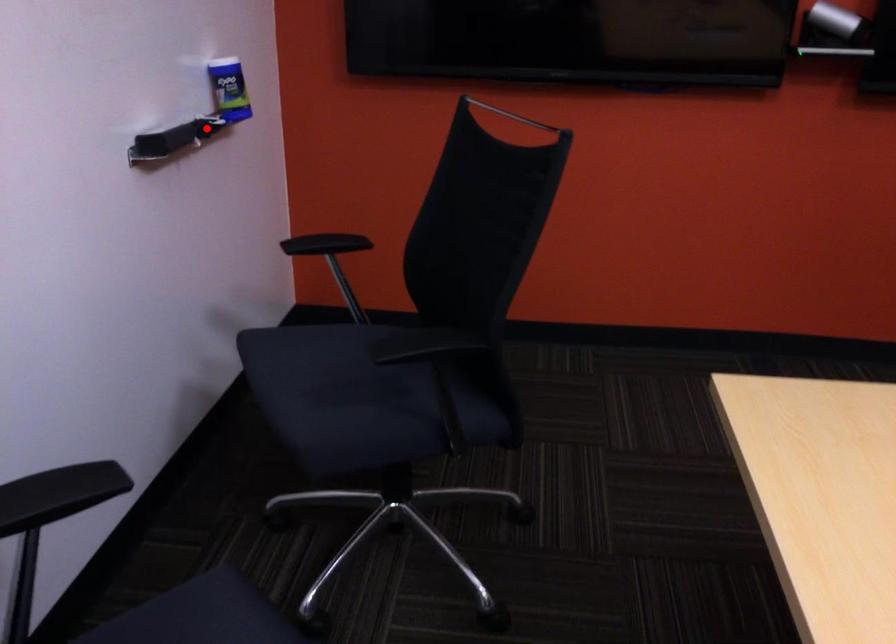
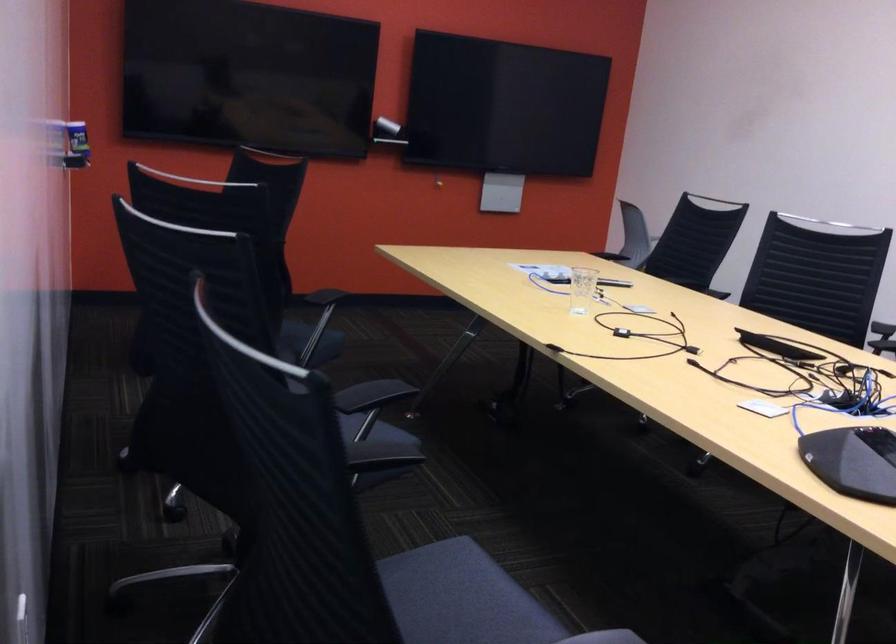
The point at the highlighted location is marked in the first image. Where is the corresponding point in the second image?

(76, 145)